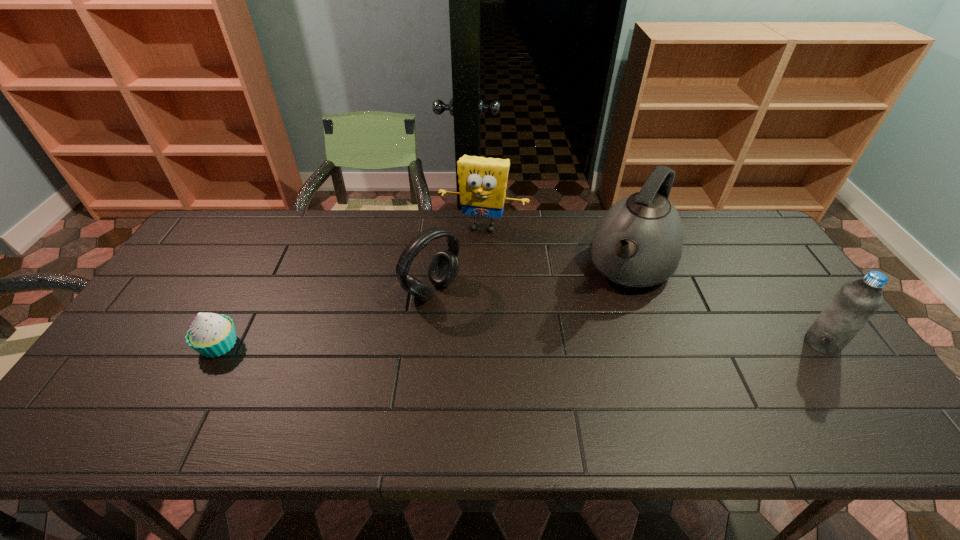
The image size is (960, 540). Find the location of `object situated at the right edge`. object situated at the right edge is located at coordinates (855, 303).

What are the coordinates of `blank space at the far edge of the desktop` in the screenshot? It's located at [385, 211].

In the image, there is a desktop. Identify the location of vacant space at the near edge. The image size is (960, 540). (373, 381).

Image resolution: width=960 pixels, height=540 pixels. Find the location of `free region at the left edge of the desktop`. free region at the left edge of the desktop is located at coordinates (198, 275).

This screenshot has height=540, width=960. I want to click on vacant space at the right edge of the desktop, so click(x=737, y=282).

The height and width of the screenshot is (540, 960). Identify the location of free point at the far right corner. (759, 234).

Where is `vacant area at the near right corner`? The image size is (960, 540). vacant area at the near right corner is located at coordinates (871, 396).

I want to click on free area in between the fourth tallest object and the cupcake, so click(325, 318).

Locate an element on the screen. This screenshot has width=960, height=540. free space between the headset and the kettle is located at coordinates (532, 279).

Locate an element on the screen. The image size is (960, 540). free space between the kettle and the headset is located at coordinates pyautogui.click(x=532, y=279).